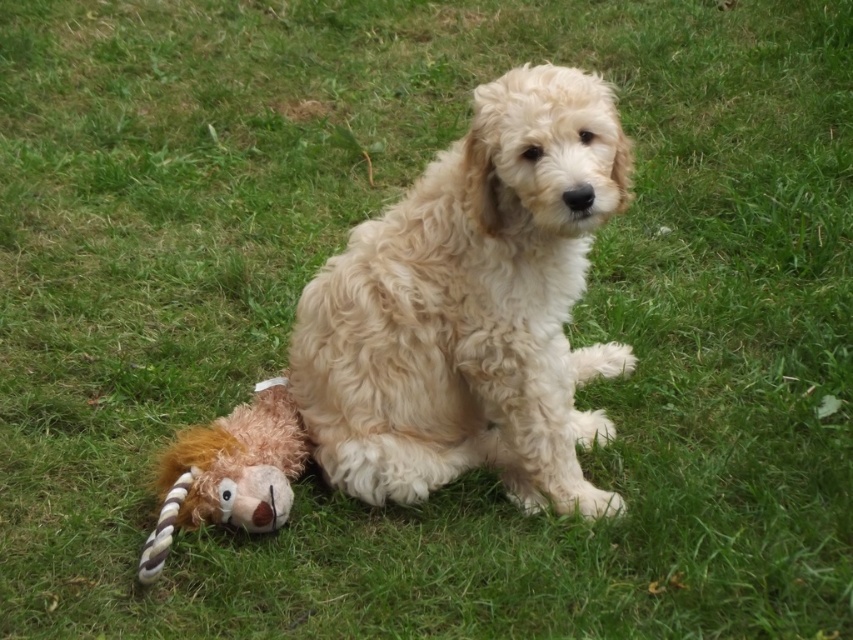
Question: Does fluffy white dog at center have a lesser width compared to fuzzy brown plush toy at lower left?

Choices:
 (A) yes
 (B) no

Answer: (B)

Question: Which point is closer to the camera?

Choices:
 (A) fluffy white dog at center
 (B) fuzzy brown plush toy at lower left

Answer: (A)

Question: Does fluffy white dog at center appear on the left side of fuzzy brown plush toy at lower left?

Choices:
 (A) yes
 (B) no

Answer: (B)

Question: Does fluffy white dog at center have a lesser width compared to fuzzy brown plush toy at lower left?

Choices:
 (A) no
 (B) yes

Answer: (A)

Question: Which of the following is the farthest from the observer?

Choices:
 (A) fluffy white dog at center
 (B) fuzzy brown plush toy at lower left

Answer: (B)